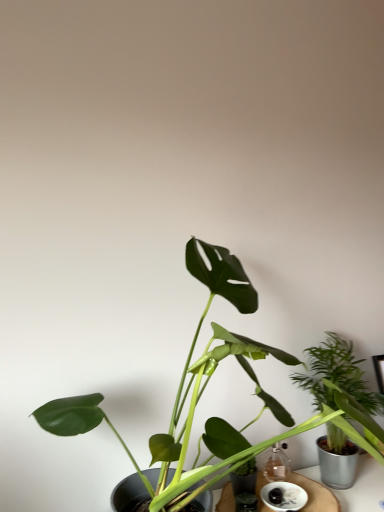
Question: Is green leafy plant at right, which is the 2th houseplant in front-to-back order, in front of or behind white ceramic saucer at lower center in the image?

Choices:
 (A) behind
 (B) front

Answer: (A)

Question: From the image's perspective, is green leafy plant at right, which is the 2th houseplant in front-to-back order, above or below white ceramic saucer at lower center?

Choices:
 (A) above
 (B) below

Answer: (A)

Question: Based on their relative distances, which object is farther from the white ceramic saucer at lower center?

Choices:
 (A) green leafy plant at right, which is the 2th houseplant in front-to-back order
 (B) wooden table at center
 (C) green matte leafy plant at center, marked as the first houseplant in a front-to-back arrangement

Answer: (C)

Question: Estimate the real-world distances between objects in this image. Which object is farther from the wooden table at center?

Choices:
 (A) green matte leafy plant at center, marked as the first houseplant in a front-to-back arrangement
 (B) green leafy plant at right, which is the 2th houseplant in front-to-back order
 (C) white ceramic saucer at lower center

Answer: (A)